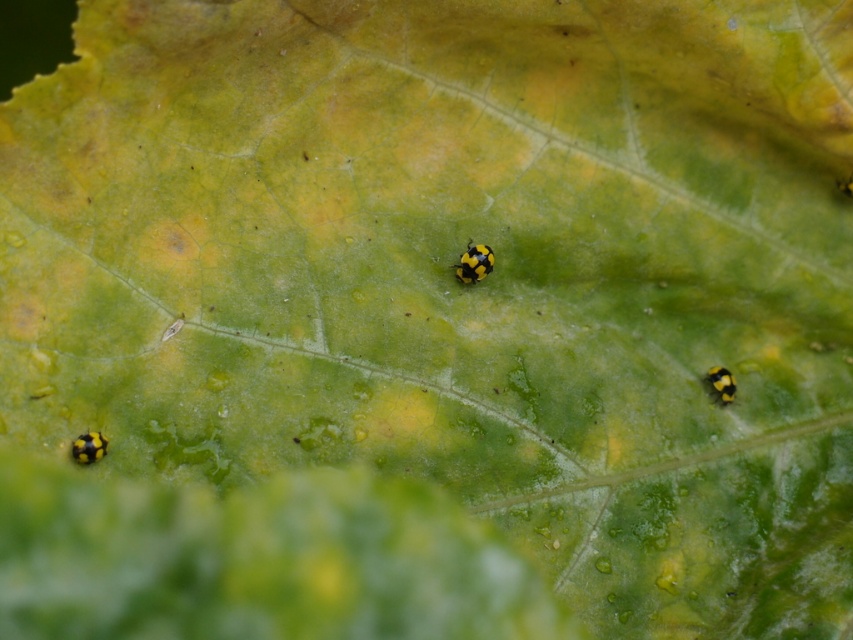
Question: Among these objects, which one is farthest from the camera?

Choices:
 (A) yellow matte beetle at center
 (B) yellow matte insect at bottom left
 (C) yellow matte/black textured caterpillar at lower right

Answer: (A)

Question: Is yellow matte beetle at center below yellow matte insect at bottom left?

Choices:
 (A) yes
 (B) no

Answer: (B)

Question: Which point appears farthest from the camera in this image?

Choices:
 (A) (103, 445)
 (B) (717, 365)

Answer: (B)

Question: Is yellow matte beetle at center thinner than yellow matte/black textured caterpillar at lower right?

Choices:
 (A) yes
 (B) no

Answer: (B)

Question: Which point is closer to the camera?

Choices:
 (A) (471, 269)
 (B) (732, 378)
 (C) (90, 448)

Answer: (C)

Question: Does yellow matte beetle at center appear under yellow matte/black textured caterpillar at lower right?

Choices:
 (A) yes
 (B) no

Answer: (B)